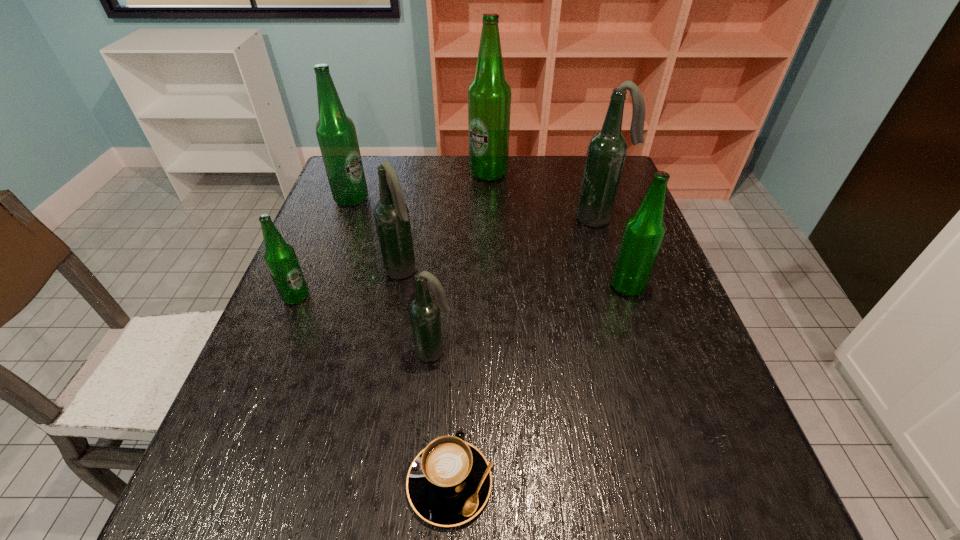
You are a GUI agent. You are given a task and a screenshot of the screen. Output one action in this format:
    pyautogui.click(x=<x>, y=<y>)
    Task: Click on the farthest green beer bottle
    
    Given the screenshot: What is the action you would take?
    pyautogui.click(x=489, y=94)

Locate an element on the screen. The height and width of the screenshot is (540, 960). the second green beer bottle from right to left is located at coordinates (489, 94).

You are a GUI agent. You are given a task and a screenshot of the screen. Output one action in this format:
    pyautogui.click(x=<x>, y=<y>)
    Task: Click on the second farthest beer bottle
    
    Given the screenshot: What is the action you would take?
    pyautogui.click(x=336, y=133)

This screenshot has height=540, width=960. Identify the location of the seventh nearest object. (336, 133).

I want to click on the sixth nearest object, so click(x=607, y=149).

Identify the location of the third farthest beer bottle. This screenshot has height=540, width=960. (607, 149).

This screenshot has width=960, height=540. I want to click on the second nearest dark beer bottle, so click(x=391, y=215).

Where is `the leftmost dark beer bottle`? Image resolution: width=960 pixels, height=540 pixels. the leftmost dark beer bottle is located at coordinates (391, 215).

Where is `the rightmost green beer bottle`? the rightmost green beer bottle is located at coordinates (644, 232).

The image size is (960, 540). In order to click on the smallest green beer bottle in this screenshot , I will do `click(281, 260)`.